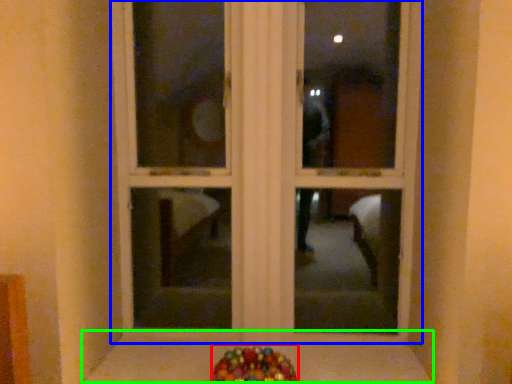
Question: Estimate the real-world distances between objects in this image. Which object is closer to candy (highlighted by a red box), window frame (highlighted by a blue box) or window sill (highlighted by a green box)?

Choices:
 (A) window frame
 (B) window sill

Answer: (B)